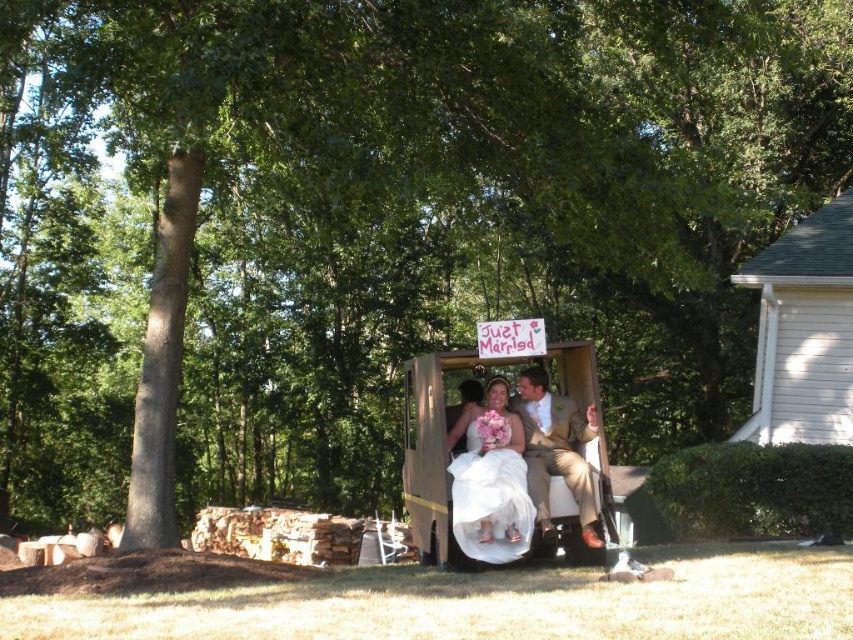
Measure the distance between point (486, 480) and camera.

The distance of point (486, 480) from camera is 26.12 feet.

Can you confirm if white satin dress at center is positioned below light brown textured suit at center?

Indeed, white satin dress at center is positioned under light brown textured suit at center.

Is point (509, 417) in front of point (552, 461)?

That is False.

Locate an element on the screen. white satin dress at center is located at coordinates (491, 481).